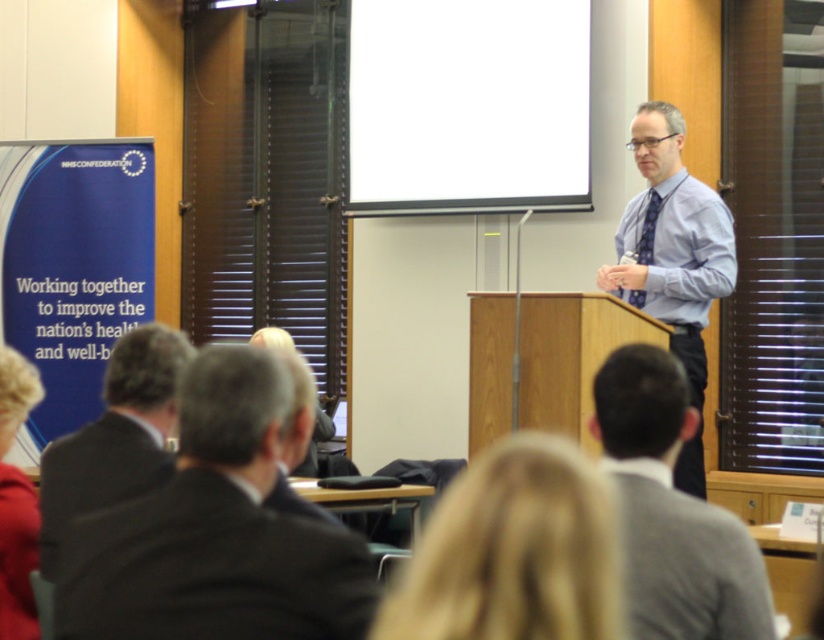
Does black suit at left appear on the right side of blonde hair at lower left?

Yes, black suit at left is to the right of blonde hair at lower left.

Who is positioned more to the left, black suit at left or blonde hair at lower left?

blonde hair at lower left

Between point (260, 509) and point (2, 346), which one is positioned behind?

The point (2, 346) is more distant.

I want to click on black suit at left, so click(214, 532).

Does light blue cotton dress shirt at upper right have a smaller size compared to blonde hair at lower left?

No, light blue cotton dress shirt at upper right is not smaller than blonde hair at lower left.

Is light blue cotton dress shirt at upper right closer to camera compared to blonde hair at lower left?

That is False.

Identify the location of light blue cotton dress shirt at upper right. (681, 250).

The width and height of the screenshot is (824, 640). I want to click on light blue cotton dress shirt at upper right, so click(681, 250).

Who is lower down, blue shirt at center or light blue cotton dress shirt at upper right?

blue shirt at center is lower down.

Between blue shirt at center and light blue cotton dress shirt at upper right, which one has more height?

With more height is blue shirt at center.

Image resolution: width=824 pixels, height=640 pixels. I want to click on blue shirt at center, so click(673, 257).